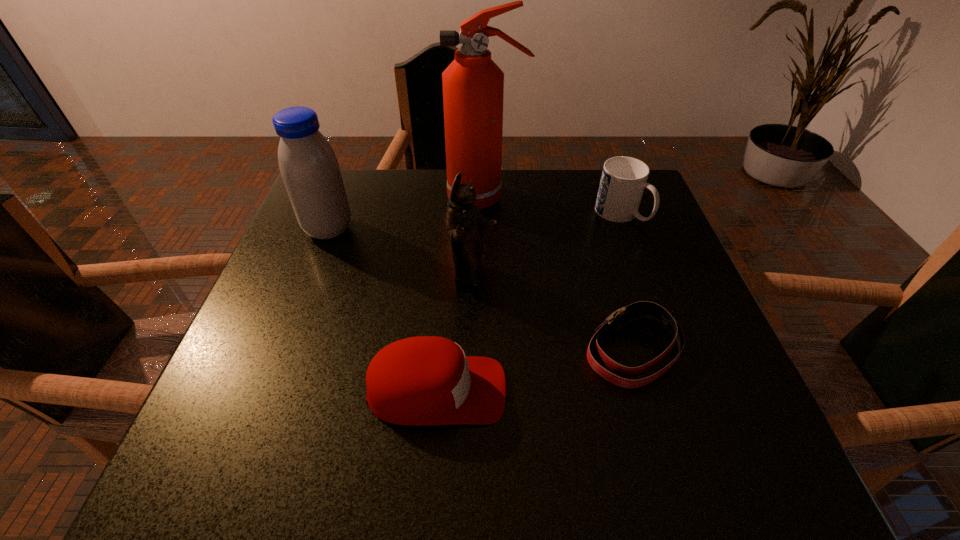
You are a GUI agent. You are given a task and a screenshot of the screen. Output one action in this format:
    pyautogui.click(x=<x>, y=<y>)
    Task: Click on the fire extinguisher
    
    Given the screenshot: What is the action you would take?
    pyautogui.click(x=473, y=85)

Find the location of a particular element. soya milk is located at coordinates (308, 165).

Locate an element on the screen. This screenshot has height=540, width=960. the fourth shortest object is located at coordinates (464, 222).

Where is `the fourth farthest object`? The height and width of the screenshot is (540, 960). the fourth farthest object is located at coordinates (464, 222).

Locate an element on the screen. This screenshot has width=960, height=540. mug is located at coordinates (623, 180).

At what (x,y) coordinates should I click in order to perform the action: click on baseball cap. Please return your answer as a coordinate pair (x, y). This screenshot has height=540, width=960. Looking at the image, I should click on (425, 380).

Identify the location of dog collar. (618, 318).

I want to click on free region located at the nozzle of the tallest object, so click(418, 199).

The width and height of the screenshot is (960, 540). In order to click on vacant space situated 0.150m at the nozzle of the tallest object in this screenshot , I will do `click(392, 199)`.

In order to click on free space located at the nozzle of the tallest object in this screenshot , I will do `click(350, 199)`.